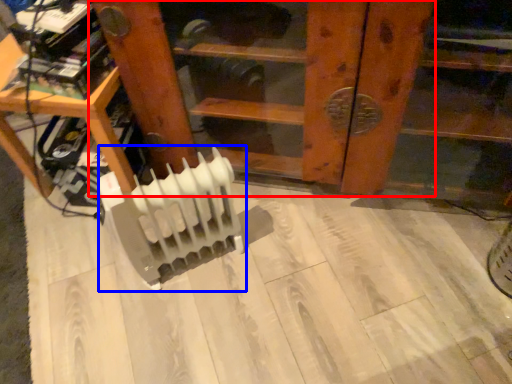
Question: Which object appears closest to the camera in this image, furniture (highlighted by a red box) or radiator (highlighted by a blue box)?

Choices:
 (A) furniture
 (B) radiator

Answer: (A)